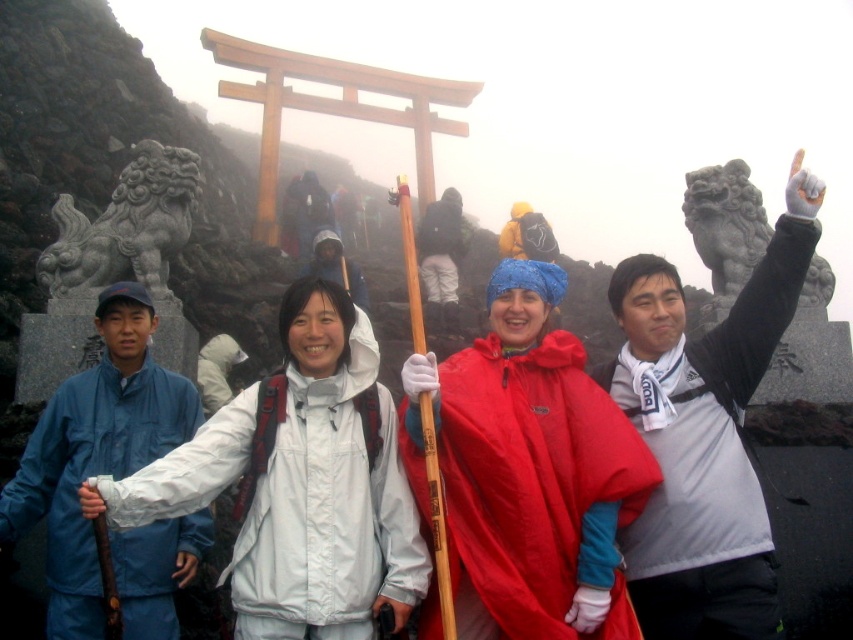
Question: Which object appears closest to the camera in this image?

Choices:
 (A) stone lion at upper center
 (B) gray stone lion at left

Answer: (B)

Question: Considering the real-world distances, which object is farthest from the stone lion at upper center?

Choices:
 (A) gray stone lion at left
 (B) red matte raincoat at center

Answer: (A)

Question: Observing the image, what is the correct spatial positioning of red matte raincoat at center in reference to white fabric at upper right?

Choices:
 (A) above
 (B) below

Answer: (B)

Question: Among these objects, which one is farthest from the camera?

Choices:
 (A) gray stone lion at left
 (B) red matte raincoat at center

Answer: (A)

Question: Is red matte raincoat at center smaller than white fabric at upper right?

Choices:
 (A) yes
 (B) no

Answer: (A)

Question: Does red matte raincoat at center appear over white fabric at upper right?

Choices:
 (A) yes
 (B) no

Answer: (B)